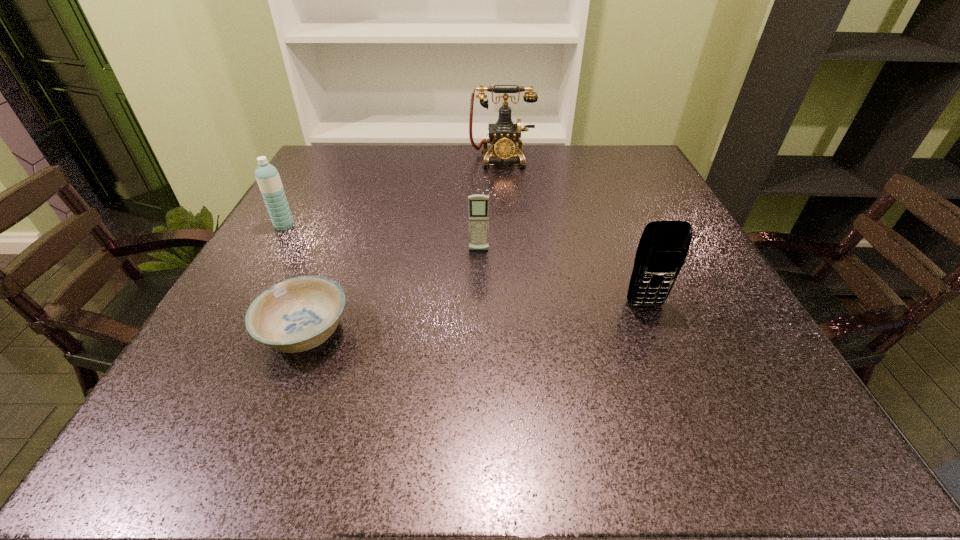
Where is `free region at the left edge of the desktop`? free region at the left edge of the desktop is located at coordinates (348, 188).

You are a GUI agent. You are given a task and a screenshot of the screen. Output one action in this format:
    pyautogui.click(x=<x>, y=<y>)
    Task: Click on the vacant space at the right edge
    The width and height of the screenshot is (960, 540).
    Given the screenshot: What is the action you would take?
    pyautogui.click(x=642, y=209)

The height and width of the screenshot is (540, 960). I want to click on vacant space at the near left corner of the desktop, so click(258, 402).

Where is `vacant space at the near right corner of the desktop`? vacant space at the near right corner of the desktop is located at coordinates (734, 433).

At what (x,y) coordinates should I click in order to perform the action: click on free space between the fourth tallest object and the bowl. Please return your answer as a coordinate pair (x, y). The image size is (960, 540). Looking at the image, I should click on (393, 292).

Locate an element on the screen. vacant region between the taller cellular telephone and the leftmost object is located at coordinates (465, 265).

Find the location of `vacant region between the farthest object and the fourth object from right to left`. vacant region between the farthest object and the fourth object from right to left is located at coordinates (403, 246).

This screenshot has width=960, height=540. Identify the location of vacant region between the left cellular telephone and the water bottle. (381, 238).

This screenshot has width=960, height=540. Find the location of `blank region between the water bottle and the second shortest object`. blank region between the water bottle and the second shortest object is located at coordinates (381, 238).

Where is `free spot between the telephone and the shortest object`? This screenshot has height=540, width=960. free spot between the telephone and the shortest object is located at coordinates (403, 246).